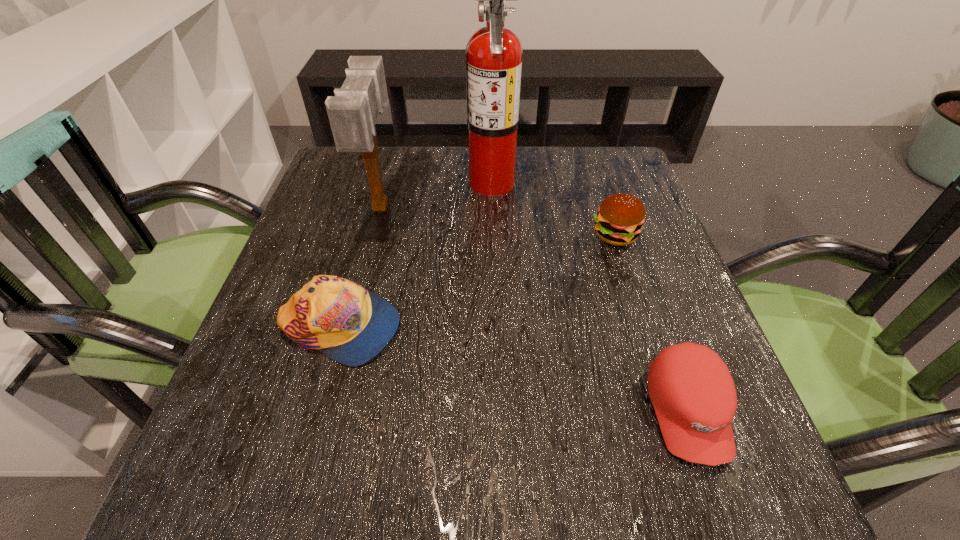
This screenshot has width=960, height=540. What are the coordinates of `object present at the near right corner` in the screenshot? It's located at (693, 394).

Locate an element on the screen. This screenshot has width=960, height=540. vacant space at the far edge of the desktop is located at coordinates (453, 174).

The image size is (960, 540). In order to click on free location at the near edge in this screenshot , I will do `click(519, 463)`.

Identify the location of vacant region at the left edge. (294, 359).

In the image, there is a desktop. Identify the location of vacant area at the right edge. (678, 278).

This screenshot has height=540, width=960. In the image, there is a desktop. Find the location of `free space at the far left corner`. free space at the far left corner is located at coordinates (350, 170).

Locate an element on the screen. Image resolution: width=960 pixels, height=540 pixels. free space at the far right corner is located at coordinates (621, 191).

This screenshot has width=960, height=540. Find the location of `vacant space that's between the right cap and the fourth shortest object`. vacant space that's between the right cap and the fourth shortest object is located at coordinates (535, 309).

This screenshot has width=960, height=540. In order to click on free space between the left cap and the fire extinguisher in this screenshot , I will do `click(416, 254)`.

Where is `vacant space that's between the tallest object and the left cap`? The height and width of the screenshot is (540, 960). vacant space that's between the tallest object and the left cap is located at coordinates (416, 254).